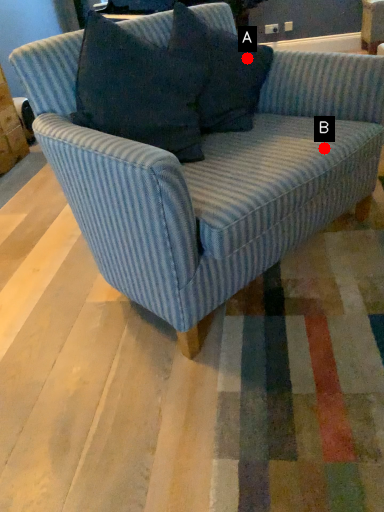
Question: Two points are circled on the image, labeled by A and B beside each circle. Which point appears closest to the camera in this image?

Choices:
 (A) A is closer
 (B) B is closer

Answer: (B)